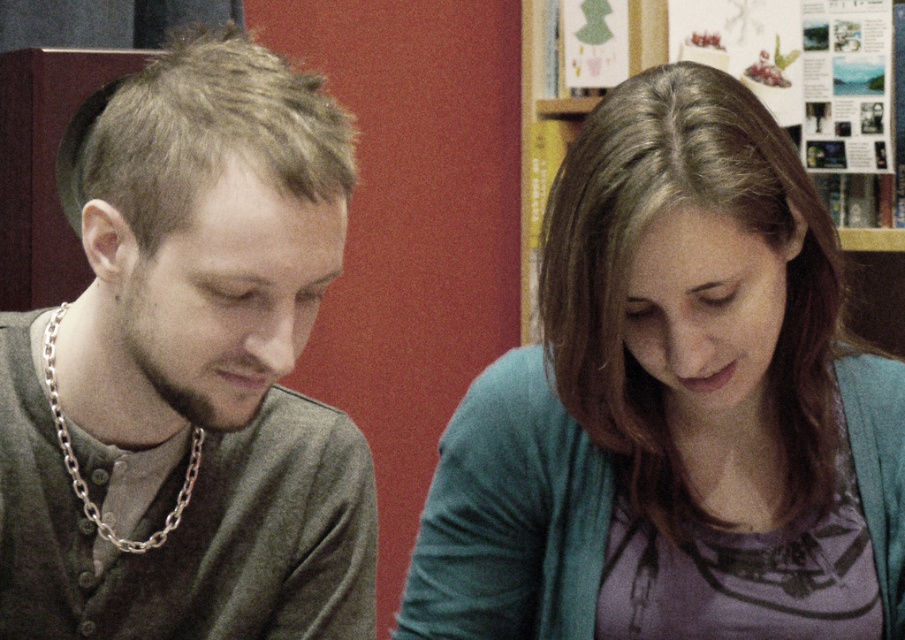
Can you confirm if matte gray sweater at left is thinner than wooden bookshelf at upper center?

In fact, matte gray sweater at left might be wider than wooden bookshelf at upper center.

Locate an element on the screen. matte gray sweater at left is located at coordinates (188, 371).

Is purple cotton shirt at center to the left of wooden bookshelf at upper center from the viewer's perspective?

Incorrect, purple cotton shirt at center is not on the left side of wooden bookshelf at upper center.

Measure the distance between purple cotton shirt at center and wooden bookshelf at upper center.

purple cotton shirt at center is 1.23 meters from wooden bookshelf at upper center.

Is point (618, 92) closer to camera compared to point (646, 64)?

Yes, point (618, 92) is in front of point (646, 64).

At what (x,y) coordinates should I click in order to perform the action: click on purple cotton shirt at center. Please return your answer as a coordinate pair (x, y). Looking at the image, I should click on (673, 404).

Can you confirm if purple cotton shirt at center is positioned below matte gray sweater at left?

Yes.

Between point (472, 557) and point (186, 220), which one is positioned behind?

The point (472, 557) is more distant.

At what (x,y) coordinates should I click in order to perform the action: click on purple cotton shirt at center. Please return your answer as a coordinate pair (x, y). The width and height of the screenshot is (905, 640). Looking at the image, I should click on pos(673,404).